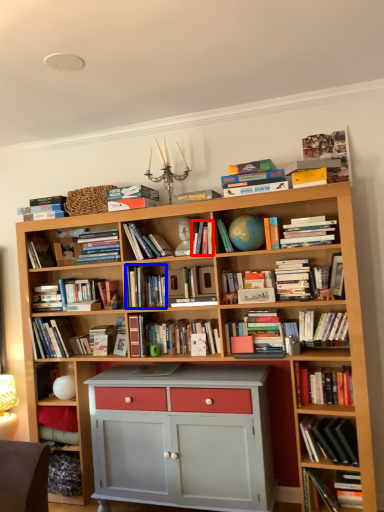
Question: Which object appears closest to the camera in this image, book (highlighted by a red box) or book (highlighted by a blue box)?

Choices:
 (A) book
 (B) book

Answer: (A)